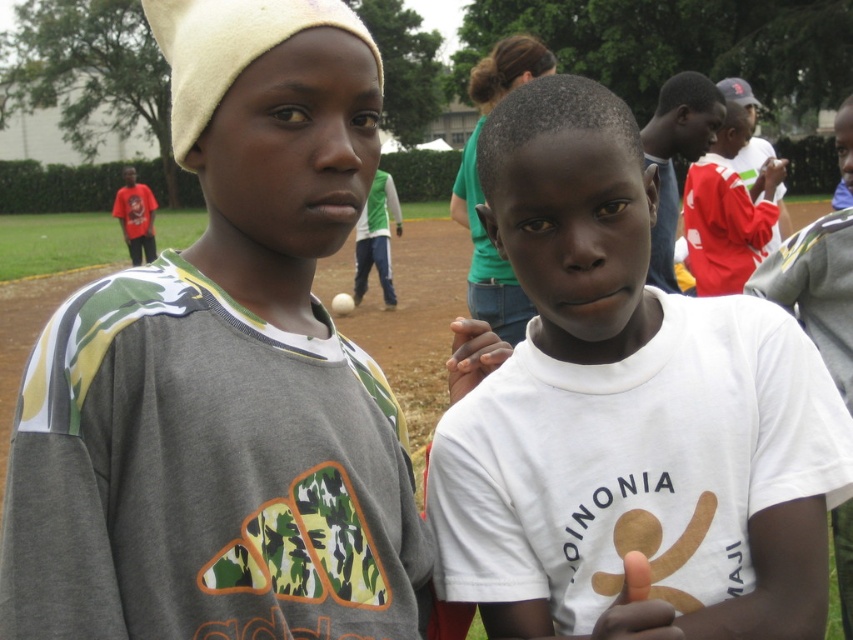
Question: Based on their relative distances, which object is farther from the white matte baseball at center?

Choices:
 (A) smooth brown hand at center
 (B) white matte shirt at center
 (C) camouflage-patterned shirt at left
 (D) smooth white hand at center

Answer: (A)

Question: Does smooth white hand at center have a smaller size compared to white matte baseball at center?

Choices:
 (A) no
 (B) yes

Answer: (B)

Question: Does camouflage-patterned shirt at left have a smaller size compared to smooth white hand at center?

Choices:
 (A) yes
 (B) no

Answer: (B)

Question: Among these points, which one is farthest from the camera?

Choices:
 (A) (674, 625)
 (B) (444, 586)
 (C) (480, 353)

Answer: (C)

Question: Does red cotton shirt at upper right come behind white matte baseball at center?

Choices:
 (A) yes
 (B) no

Answer: (B)

Question: Which object is positioned farthest from the smooth white hand at center?

Choices:
 (A) white matte baseball at center
 (B) red cotton shirt at upper right

Answer: (A)